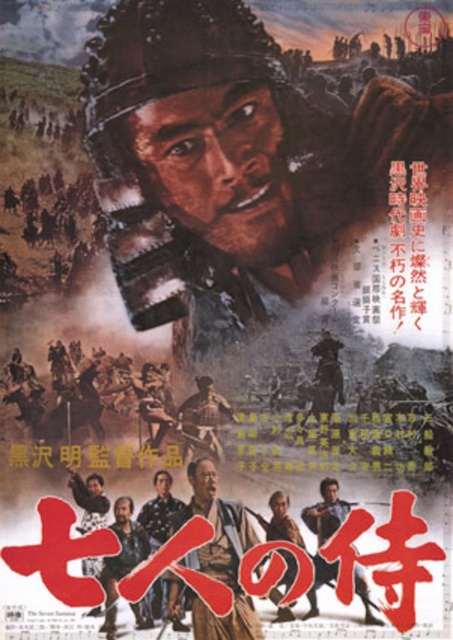
Can you confirm if matte brown robe at center is taller than dark brown leather jacket at center?

Correct, matte brown robe at center is much taller as dark brown leather jacket at center.

From the picture: Can you confirm if matte brown robe at center is shorter than dark brown leather jacket at center?

No, matte brown robe at center is not shorter than dark brown leather jacket at center.

Describe the element at coordinates (216, 560) in the screenshot. I see `matte brown robe at center` at that location.

In order to click on matte brown robe at center in this screenshot , I will do `click(216, 560)`.

Is matte black samurai armor at center shorter than matte brown helmet at center?

No, matte black samurai armor at center is not shorter than matte brown helmet at center.

Between matte black samurai armor at center and matte brown helmet at center, which one appears on the right side from the viewer's perspective?

matte black samurai armor at center is more to the right.

Between point (318, 614) and point (201, 376), which one is positioned behind?

Positioned behind is point (201, 376).

Find the location of a particular element. The width and height of the screenshot is (453, 640). matte black samurai armor at center is located at coordinates pyautogui.click(x=326, y=512).

In the scene shown: Who is more distant from viewer, (x=213, y=486) or (x=149, y=604)?

The point (x=213, y=486) is behind.

Can you confirm if matte brown robe at center is wider than matte brown uniform at center?

Indeed, matte brown robe at center has a greater width compared to matte brown uniform at center.

Who is more forward, (191, 596) or (158, 493)?

Point (191, 596) is in front.

Find the location of `matte brown robe at center`. matte brown robe at center is located at coordinates (216, 560).